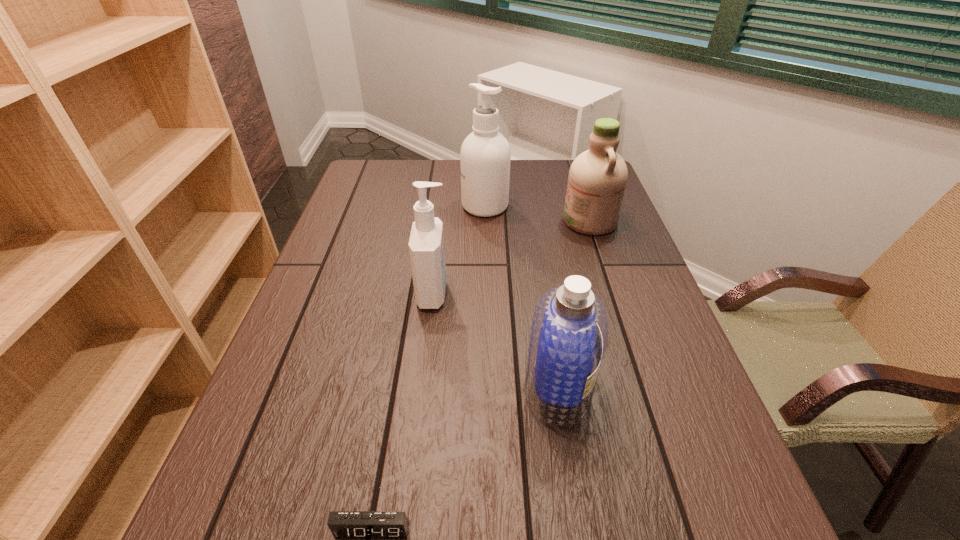
Locate an element on the screen. The image size is (960, 540). vacant point located between the tallest cleansing agent and the rightmost cleansing agent is located at coordinates (538, 213).

Where is `vacant space that is in between the second nearest cleansing agent and the fourth farthest object`? This screenshot has width=960, height=540. vacant space that is in between the second nearest cleansing agent and the fourth farthest object is located at coordinates click(495, 341).

Select which object is the closest to the second nearest cleansing agent. Please provide its 2D coordinates. Your answer should be formatted as a tuple, i.e. [(x, y)], where the tuple contains the x and y coordinates of a point satisfying the conditions above.

[(569, 331)]

Choose which object is the fourth nearest neighbor to the leftmost cleansing agent. Please provide its 2D coordinates. Your answer should be formatted as a tuple, i.e. [(x, y)], where the tuple contains the x and y coordinates of a point satisfying the conditions above.

[(343, 524)]

At what (x,y) coordinates should I click in order to perform the action: click on cleansing agent that is the second closest to the tallest object. Please return your answer as a coordinate pair (x, y). The height and width of the screenshot is (540, 960). Looking at the image, I should click on (426, 244).

The width and height of the screenshot is (960, 540). I want to click on cleansing agent that can be found as the second closest to the tallest object, so click(x=426, y=244).

Where is `free space that satisfies the following two spatial constraints: 1. on the front label of the third farthest cleansing agent; 2. on the front-facing side of the shortest object`? The width and height of the screenshot is (960, 540). free space that satisfies the following two spatial constraints: 1. on the front label of the third farthest cleansing agent; 2. on the front-facing side of the shortest object is located at coordinates (406, 529).

In order to click on free space that satisfies the following two spatial constraints: 1. on the front label of the nearest cleansing agent; 2. on the right side of the leftmost cleansing agent in this screenshot , I will do `click(422, 388)`.

Where is `vacant space that satisfies the following two spatial constraints: 1. on the front label of the rightmost cleansing agent; 2. on the front-facing side of the alarm clock`? vacant space that satisfies the following two spatial constraints: 1. on the front label of the rightmost cleansing agent; 2. on the front-facing side of the alarm clock is located at coordinates (692, 529).

This screenshot has height=540, width=960. Identify the location of free location that satisfies the following two spatial constraints: 1. on the front label of the tallest cleansing agent; 2. on the left side of the nearest cleansing agent. (488, 388).